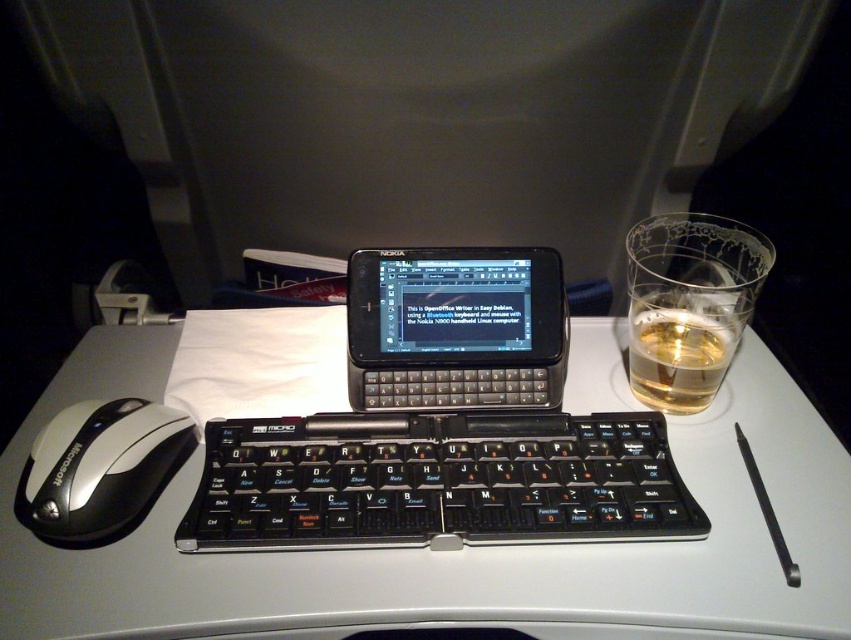
Question: Does white plastic table at center lie in front of black plastic nokia phone at center?

Choices:
 (A) no
 (B) yes

Answer: (B)

Question: Among these objects, which one is nearest to the camera?

Choices:
 (A) translucent glass at right
 (B) silver/plastic/mouse at left
 (C) black plastic nokia phone at center
 (D) black plastic keyboard at center

Answer: (B)

Question: From the image, what is the correct spatial relationship of white plastic table at center in relation to silver/plastic/mouse at left?

Choices:
 (A) left
 (B) right

Answer: (B)

Question: Is black plastic keyboard at center wider than translucent glass at right?

Choices:
 (A) yes
 (B) no

Answer: (A)

Question: Among these objects, which one is farthest from the camera?

Choices:
 (A) translucent glass at right
 (B) silver/plastic/mouse at left

Answer: (A)

Question: Which of these objects is positioned closest to the translucent glass at right?

Choices:
 (A) black plastic keyboard at center
 (B) black plastic nokia phone at center
 (C) silver/plastic/mouse at left

Answer: (B)